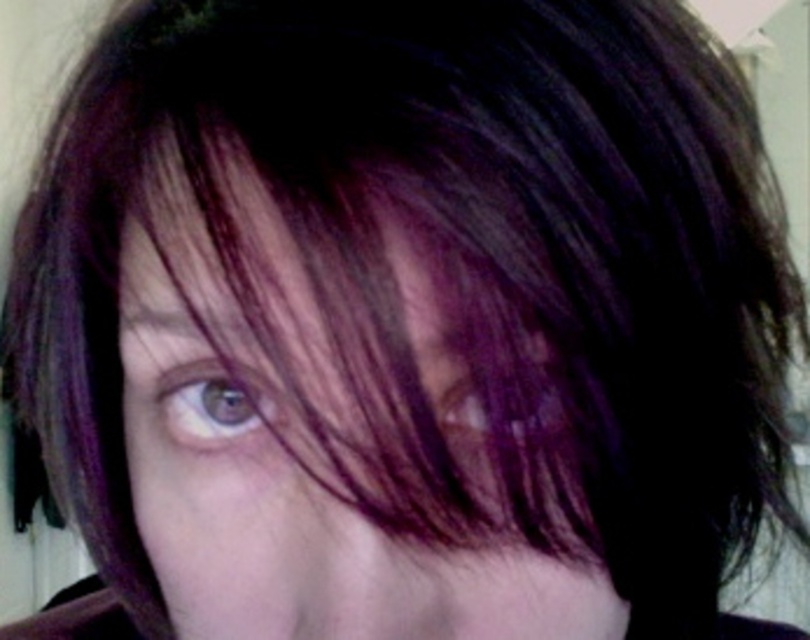
How distant is purple hair at center from brown matte eye at center?

purple hair at center is 3.38 centimeters from brown matte eye at center.

From the picture: Who is lower down, purple hair at center or brown matte eye at center?

purple hair at center

Find the location of a particular element. purple hair at center is located at coordinates (318, 436).

Is point (167, 484) farther from viewer compared to point (458, 406)?

Yes, it is.

Based on the photo, between purple hair at center and purple shiny hair at center, which one appears on the right side from the viewer's perspective?

purple shiny hair at center is more to the right.

The image size is (810, 640). Describe the element at coordinates (318, 436) in the screenshot. I see `purple hair at center` at that location.

In order to click on purple hair at center in this screenshot , I will do `click(318, 436)`.

Which is more to the left, brown matte eye at center or purple shiny hair at center?

Positioned to the left is brown matte eye at center.

Can you confirm if brown matte eye at center is wider than purple shiny hair at center?

Yes.

Which is behind, point (194, 410) or point (539, 369)?

Point (194, 410)

Locate an element on the screen. This screenshot has width=810, height=640. brown matte eye at center is located at coordinates tap(211, 403).